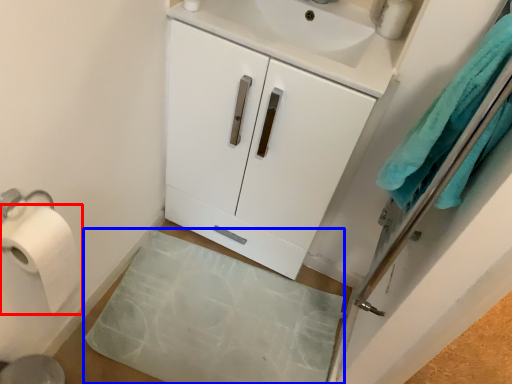
Question: Which object is closer to the camera taking this photo, toilet paper (highlighted by a red box) or bath mat (highlighted by a blue box)?

Choices:
 (A) toilet paper
 (B) bath mat

Answer: (A)